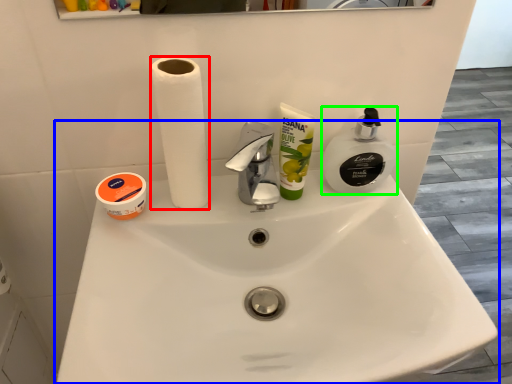
Question: Based on their relative distances, which object is farther from paper towel (highlighted by a red box)? Choose from sink (highlighted by a blue box) and soap dispenser (highlighted by a green box).

Choices:
 (A) sink
 (B) soap dispenser

Answer: (B)